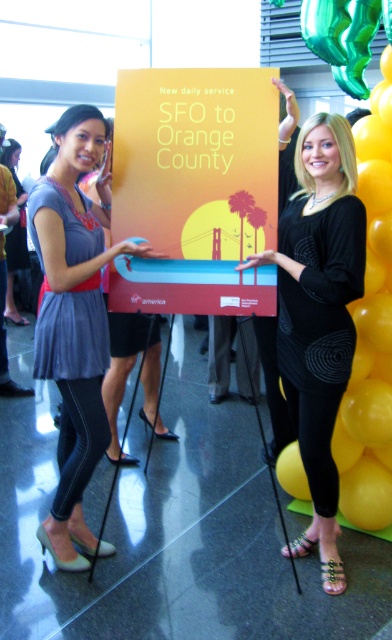
Who is positioned more to the right, black matte dress at center or yellow glossy balloon at upper right?

Positioned to the right is yellow glossy balloon at upper right.

Does point (344, 161) come in front of point (384, 49)?

Yes.

Is point (326, 285) closer to viewer compared to point (368, 515)?

Yes, point (326, 285) is closer to viewer.

Find the location of a particular element. black matte dress at center is located at coordinates (319, 314).

Is black matte dress at center shorter than matte gray dress at center?

Incorrect, black matte dress at center's height does not fall short of matte gray dress at center's.

Can you confirm if black matte dress at center is bigger than matte gray dress at center?

No, black matte dress at center is not bigger than matte gray dress at center.

Does point (283, 248) come behind point (41, 240)?

Yes.

Identify the location of black matte dress at center. This screenshot has width=392, height=640. (319, 314).

Which is more to the left, matte gray dress at center or yellow glossy balloon at upper right?

Positioned to the left is matte gray dress at center.

Measure the distance from matte gray dress at center to yellow glossy balloon at upper right.

A distance of 4.08 feet exists between matte gray dress at center and yellow glossy balloon at upper right.

Does point (96, 417) come farther from viewer compared to point (352, 467)?

No, (96, 417) is in front of (352, 467).

Locate an element on the screen. matte gray dress at center is located at coordinates pos(74,317).